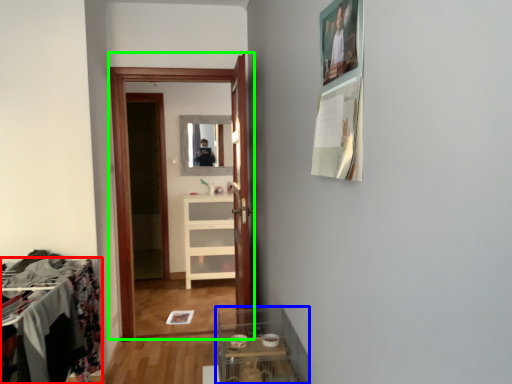
Question: Which object is the closest to the furniture (highlighted by a red box)? Choose among these: glass box (highlighted by a blue box) or clothing store (highlighted by a green box).

Choices:
 (A) glass box
 (B) clothing store

Answer: (A)